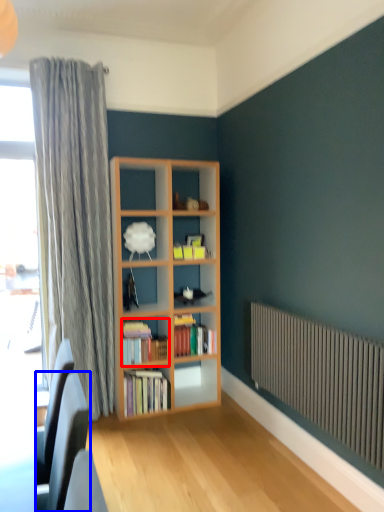
Question: Which of the following is the closest to the observer, book (highlighted by a red box) or swivel chair (highlighted by a blue box)?

Choices:
 (A) book
 (B) swivel chair

Answer: (B)